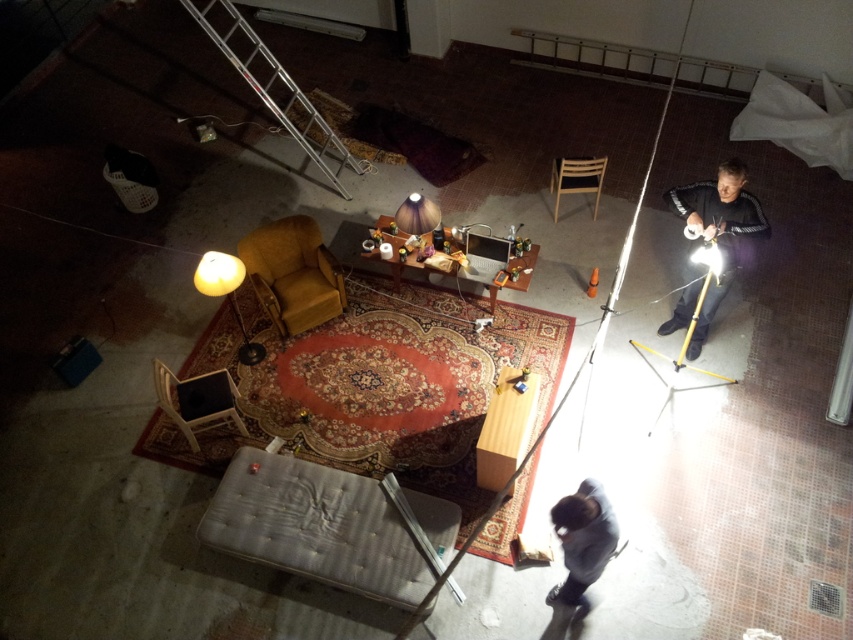
Question: Is black matte jacket at right wider than wooden table at center?

Choices:
 (A) no
 (B) yes

Answer: (A)

Question: Is wooden table at center below matte brown lampshade at center?

Choices:
 (A) yes
 (B) no

Answer: (A)

Question: Is matte yellow armchair at center-left positioned at the back of dark gray fabric at lower center?

Choices:
 (A) yes
 (B) no

Answer: (A)

Question: Estimate the real-world distances between objects in this image. Which object is closer to the white plastic chair at lower left?

Choices:
 (A) light gray fabric ottoman at center
 (B) matte yellow armchair at center-left
 (C) dark gray fabric at lower center
 (D) wooden table at center

Answer: (A)

Question: Based on their relative distances, which object is farther from the matte yellow armchair at center-left?

Choices:
 (A) matte brown lampshade at center
 (B) wooden box at center

Answer: (B)

Question: Which object is closer to the camera taking this photo?

Choices:
 (A) white plastic chair at lower left
 (B) black matte jacket at right
 (C) light gray fabric ottoman at center

Answer: (C)